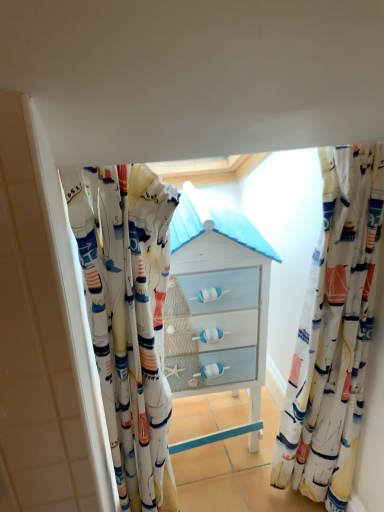
I want to click on free spot in front of matte white chest of drawers at center, so click(232, 485).